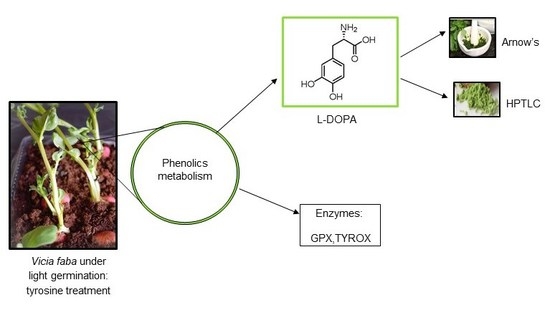
Find the location of `bowl like object used to crush the leaves called a mortar`. bowl like object used to crush the leaves called a mortar is located at coordinates (482, 49).